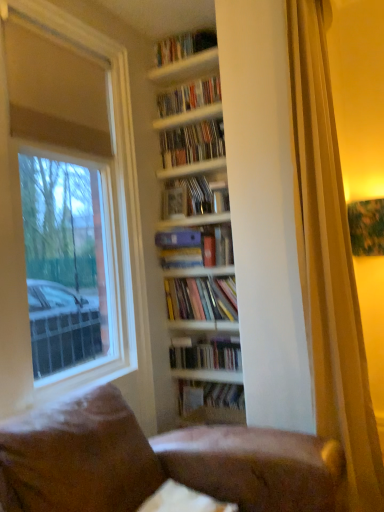
Question: Can you confirm if white glossy shelves at upper center, the 1th shelf from the top, is positioned to the left of hardcover books at center, placed as the seventh book when sorted from top to bottom?

Choices:
 (A) yes
 (B) no

Answer: (A)

Question: From the image's perspective, is white glossy shelves at upper center, the 1th shelf from the top, located beneath hardcover books at center, placed as the seventh book when sorted from top to bottom?

Choices:
 (A) no
 (B) yes

Answer: (A)

Question: Does white glossy shelves at upper center, which is the second shelf from bottom to top, appear on the right side of hardcover books at center, placed as the seventh book when sorted from top to bottom?

Choices:
 (A) yes
 (B) no

Answer: (B)

Question: Is white glossy shelves at upper center, which is the second shelf from bottom to top, directly adjacent to hardcover books at center, placed as the seventh book when sorted from top to bottom?

Choices:
 (A) yes
 (B) no

Answer: (B)

Question: Is white glossy shelves at upper center, which is the second shelf from bottom to top, turned away from hardcover books at center, placed as the 2th book when sorted from bottom to top?

Choices:
 (A) no
 (B) yes

Answer: (A)

Question: In terms of size, does hardcover book at center appear bigger or smaller than hardcover books at center, positioned as the 3th book in bottom-to-top order?

Choices:
 (A) small
 (B) big

Answer: (A)

Question: Based on their positions, is hardcover book at center located to the left or right of hardcover books at center, the 6th book positioned from the top?

Choices:
 (A) left
 (B) right

Answer: (A)

Question: Considering the positions of hardcover book at center and hardcover books at center, positioned as the 3th book in bottom-to-top order, in the image, is hardcover book at center wider or thinner than hardcover books at center, positioned as the 3th book in bottom-to-top order,?

Choices:
 (A) thin
 (B) wide

Answer: (A)

Question: Is hardcover book at center in front of or behind hardcover books at center, the 6th book positioned from the top, in the image?

Choices:
 (A) behind
 (B) front

Answer: (A)

Question: Does point (170, 42) appear closer or farther from the camera than point (205, 86)?

Choices:
 (A) closer
 (B) farther

Answer: (B)

Question: Is hardcover books at upper center, which is the first book in top-to-bottom order, in front of or behind white glossy bookshelf at upper center, the seventh book positioned from the bottom, in the image?

Choices:
 (A) behind
 (B) front

Answer: (B)

Question: Looking at the image, does hardcover books at upper center, the eighth book from the bottom, seem bigger or smaller compared to white glossy bookshelf at upper center, the seventh book positioned from the bottom?

Choices:
 (A) big
 (B) small

Answer: (A)

Question: Visually, is hardcover books at upper center, which is the first book in top-to-bottom order, positioned to the left or to the right of white glossy bookshelf at upper center, the second book viewed from the top?

Choices:
 (A) right
 (B) left

Answer: (B)

Question: From the image's perspective, relative to hardcover book at center, which is the 1th book in bottom-to-top order, is brown leather couch at lower center above or below?

Choices:
 (A) above
 (B) below

Answer: (A)

Question: Considering the positions of brown leather couch at lower center and hardcover book at center, which is the 1th book in bottom-to-top order, in the image, is brown leather couch at lower center taller or shorter than hardcover book at center, which is the 1th book in bottom-to-top order,?

Choices:
 (A) tall
 (B) short

Answer: (B)